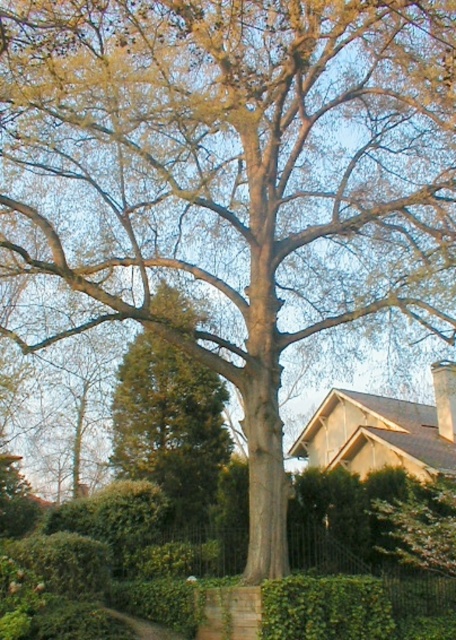
Question: Among these objects, which one is farthest from the camera?

Choices:
 (A) green leafy hedge at lower center
 (B) green leafy tree at center

Answer: (B)

Question: Is green leafy tree at center bigger than green leafy hedge at lower center?

Choices:
 (A) yes
 (B) no

Answer: (A)

Question: Can you confirm if green leafy tree at center is smaller than green leafy hedge at lower center?

Choices:
 (A) no
 (B) yes

Answer: (A)

Question: Which point is closer to the camera?

Choices:
 (A) green leafy hedge at lower center
 (B) green leafy tree at center

Answer: (A)

Question: Does green leafy tree at center have a greater width compared to green leafy hedge at lower center?

Choices:
 (A) yes
 (B) no

Answer: (A)